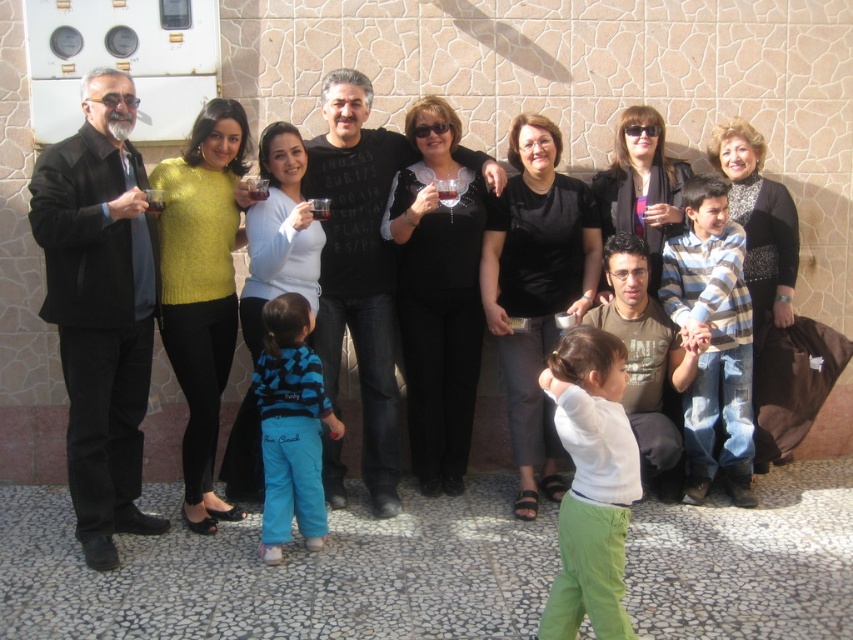
You are a photographer standing at the edge of the paved area. You want to capture a photo that includes both the blue fleece pants at lower center and the matte black sweater at center. Given the camera you have can focus on objects within a 24 inch range, will you be able to capture both subjects in focus without adjusting your position?

The distance between the blue fleece pants at lower center and the matte black sweater at center is 24.96 inches. Since the camera can focus within a 24 inch range, the subjects are slightly beyond the focus range. You may need to adjust your position to ensure both are within the 24 inch range for clear focus.

From the picture: You are a photographer trying to adjust the composition of the image. You want to ensure that the black matte pants at center and the matte black sweater at center are aligned properly. Which object should be moved to the right to achieve better symmetry?

The matte black sweater at center should be moved to the right because the black matte pants at center is already positioned on the right side of it, so moving the sweater to the right would align them symmetrically.

You are a photographer trying to adjust the composition of the group photo. You want to ensure that the blue fleece pants at lower center and the matte black sweater at center are both visible in the final shot. Based on their positions, which one should you focus on first to frame them properly?

The blue fleece pants at lower center is positioned on the right side of matte black sweater at center. To frame both properly, focus on the matte black sweater at center first as it is centrally located, then adjust to include the blue fleece pants at lower center on its right side.